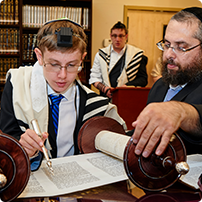
Locate an element on the screen. The height and width of the screenshot is (202, 202). book shelves is located at coordinates (36, 17), (10, 44).